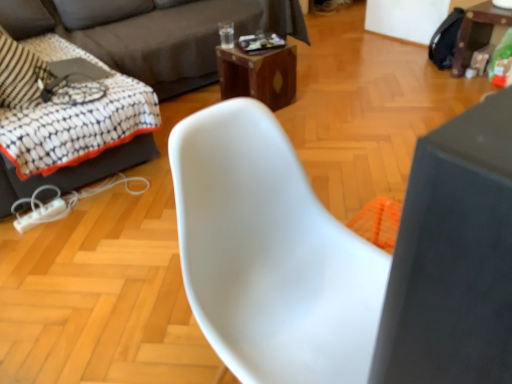
Question: Looking at the image, does woodenmaterial/texturetable at center, which is counted as the 2th table, starting from the right, seem bigger or smaller compared to wooden table at right, the first table viewed from the right?

Choices:
 (A) big
 (B) small

Answer: (B)

Question: In terms of width, does woodenmaterial/texturetable at center, which appears as the 1th table when viewed from the left, look wider or thinner when compared to wooden table at right, the first table viewed from the right?

Choices:
 (A) wide
 (B) thin

Answer: (B)

Question: Which object is positioned farthest from the wooden table at right, the 2th table positioned from the left?

Choices:
 (A) white plastic swivel chair at left
 (B) woodenmaterial/texturetable at center, which appears as the 1th table when viewed from the left
 (C) dark gray fabric couch at upper left, placed as the second studio couch when sorted from left to right
 (D) white plastic chair at center
 (E) dark gray fabric couch at upper left, positioned as the first studio couch in left-to-right order

Answer: (D)

Question: Considering the real-world distances, which object is farthest from the woodenmaterial/texturetable at center, which is counted as the 2th table, starting from the right?

Choices:
 (A) dark gray fabric couch at upper left, which is counted as the 2th studio couch, starting from the right
 (B) white plastic chair at center
 (C) dark gray fabric couch at upper left, which appears as the 1th studio couch when viewed from the right
 (D) wooden table at right, the first table viewed from the right
 (E) white plastic swivel chair at left

Answer: (B)